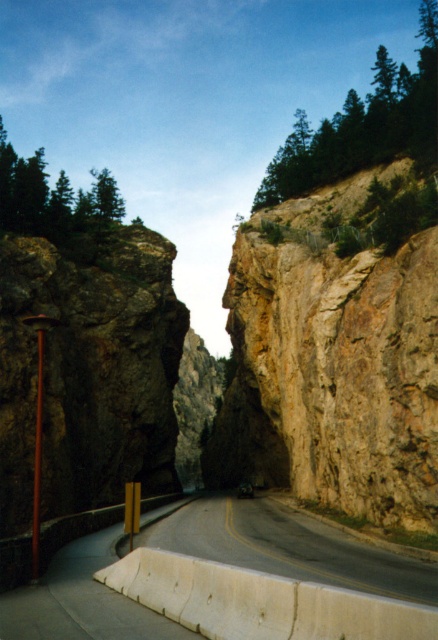
You are driving a car that is 2 meters wide. You see the white concrete barrier at lower center on the road. Can you safely pass through the area next to the barrier without hitting it?

The white concrete barrier at lower center is located at point [288,547], which indicates its position on the road. However, without knowing the exact dimensions and spacing around the barrier, it is not possible to determine if the 2 meter wide car can safely pass. More information about the barrier and road width is needed to make this assessment.

You are driving a truck that is 4 meters tall and approaching the narrow winding road shown in the image. You see the white concrete barrier at lower center and the green leafy tree at upper left. Based on their heights, will your truck clear both obstacles without hitting them?

The white concrete barrier at lower center has a lesser height compared to the green leafy tree at upper left. Since the truck is 4 meters tall, you need to compare the truck height with the tallest obstacle. The tree is taller than the barrier, so if the tree is over 4 meters, the truck might hit it. However, without exact tree height, we can only say the barrier is shorter than the tree. Consult local height restrictions or measure the tree to be sure.

You are driving a car that is 15 feet long. You see the white concrete barrier at lower center and a camera ahead. Can you safely pass between them without hitting either?

The distance between the white concrete barrier at lower center and the camera is 62.74 feet. Since your car is only 15 feet long, there is more than enough space to safely pass between them without hitting either the barrier or the camera.